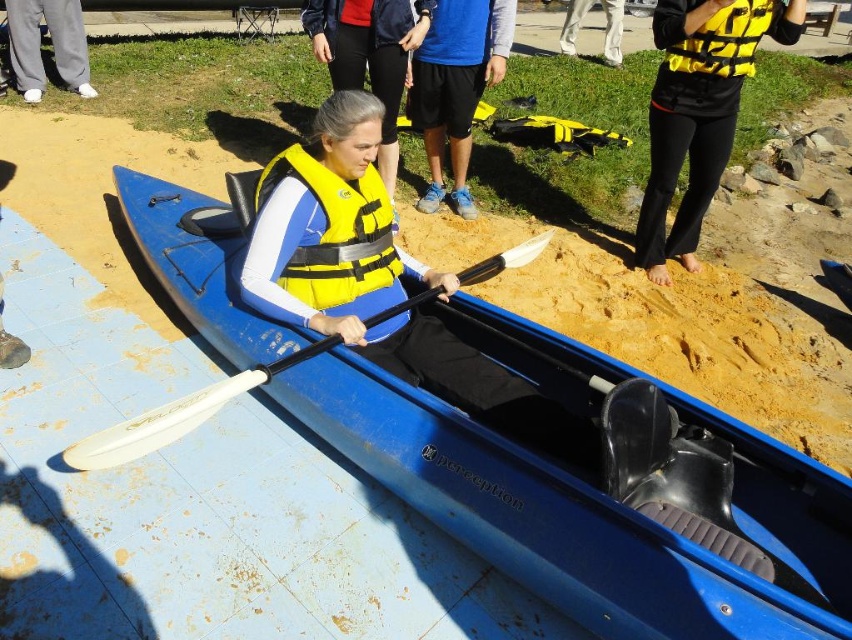
You are a photographer trying to capture a clear shot of the blue plastic kayak at center and the white plastic paddle at center. If you focus on the kayak first, will the paddle still be in focus?

The blue plastic kayak at center is in front of the white plastic paddle at center, so if you focus on the kayak, the paddle might be slightly out of focus due to the distance between them.

You are a safety inspector checking the placement of safety gear in the image. The yellow matte safety vest at center and the yellow matte life jacket at upper center must be visible to participants. Which one is positioned closer to the front of the scene?

The yellow matte safety vest at center is closer to the viewer than the yellow matte life jacket at upper center, so it is positioned closer to the front of the scene.